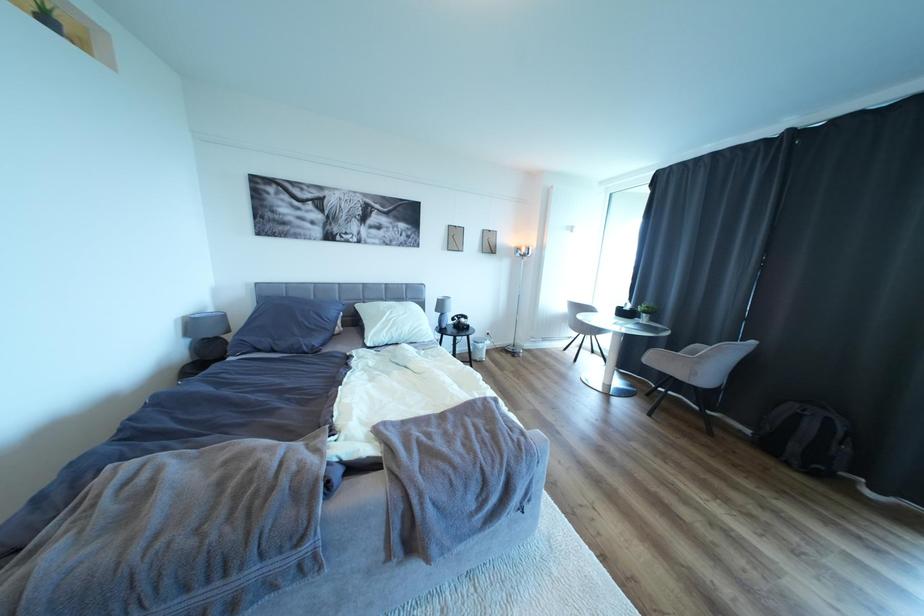
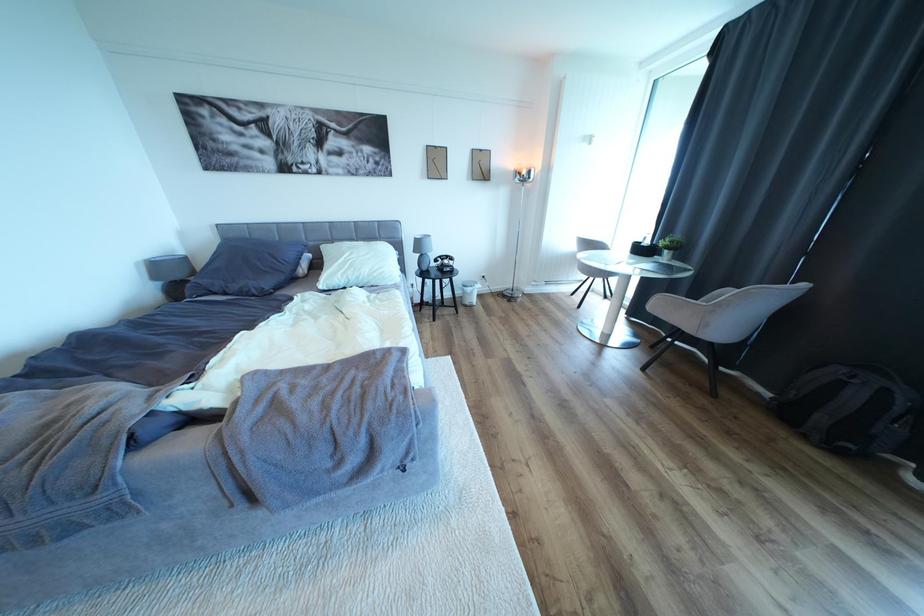
Which direction would the cameraman need to move to produce the second image?

The cameraman moved toward right, forward.